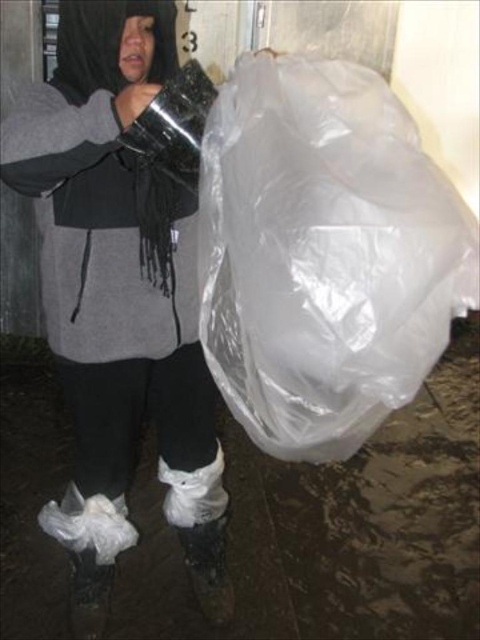
You are a photographer trying to capture the scene with the transparent plastic bag at right and the transparent plastic bag at upper right. Which plastic bag should you zoom in on to ensure it appears wider in the photo?

The transparent plastic bag at upper right should be zoomed in on because its width is greater than the transparent plastic bag at right, making it appear wider in the photo.

You are a photographer trying to capture the scene with the transparent plastic bag at upper right and the white matte boot at lower center. Which object should you zoom in on to ensure both are in focus without moving the camera?

You should zoom in on the transparent plastic bag at upper right because it is larger in size than the white matte boot at lower center, making it easier to focus on while keeping both objects in the frame.

You are a photographer trying to capture the scene with the transparent plastic bag at right and the white matte boot at lower center. Which object would appear bigger in your photo?

The transparent plastic bag at right appears bigger in the photo because it has a larger size compared to the white matte boot at lower center.